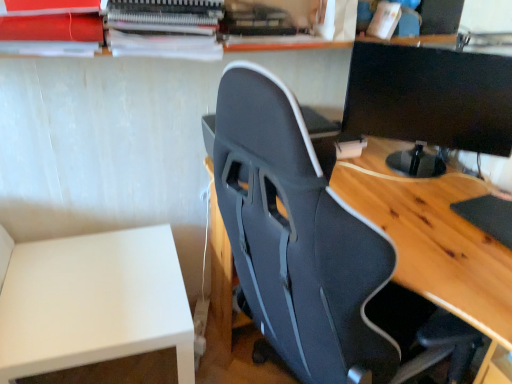
The height and width of the screenshot is (384, 512). Find the location of `blank space situated above white matte table at lower left (from a real-world perspective)`. blank space situated above white matte table at lower left (from a real-world perspective) is located at coordinates (82, 297).